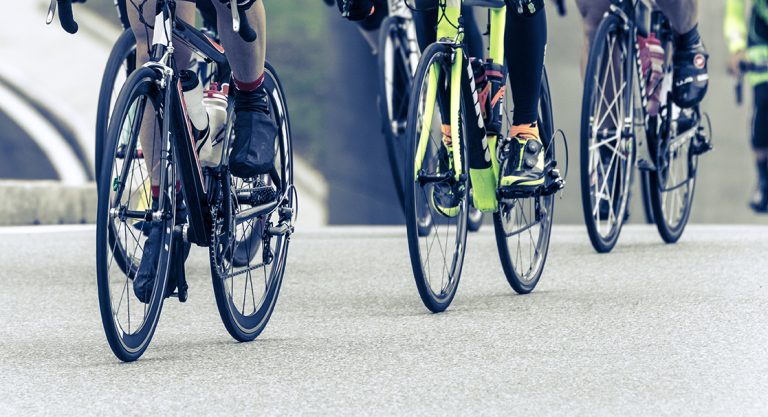
Where is `leg`? The image size is (768, 417). leg is located at coordinates (247, 57), (138, 47), (522, 27), (426, 24), (677, 12), (594, 27).